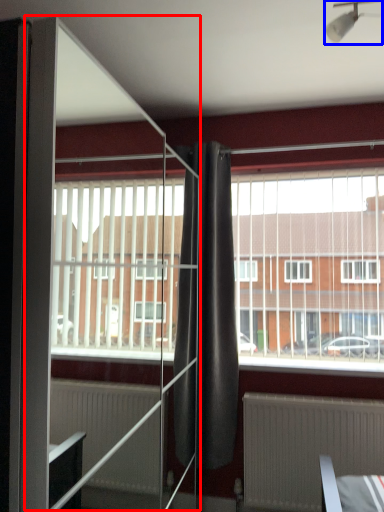
Question: Which object appears closest to the camera in this image, screen door (highlighted by a red box) or light fixture (highlighted by a blue box)?

Choices:
 (A) screen door
 (B) light fixture

Answer: (A)